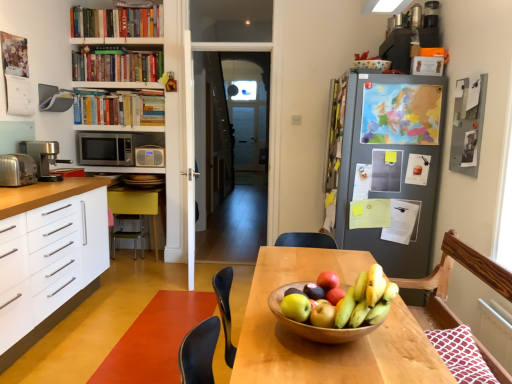
Question: Is hardcover books at upper left, positioned as the second book in top-to-bottom order, with green matte apple at center, placed as the 3th apple when sorted from back to front?

Choices:
 (A) no
 (B) yes

Answer: (A)

Question: From a real-world perspective, is hardcover books at upper left, positioned as the second book in top-to-bottom order, located beneath green matte apple at center, placed as the 3th apple when sorted from back to front?

Choices:
 (A) no
 (B) yes

Answer: (A)

Question: Is the depth of hardcover books at upper left, which is the 2th book in bottom-to-top order, greater than that of green matte apple at center, which is the 2th apple in front-to-back order?

Choices:
 (A) no
 (B) yes

Answer: (B)

Question: Is hardcover books at upper left, positioned as the second book in top-to-bottom order, thinner than green matte apple at center, placed as the 3th apple when sorted from back to front?

Choices:
 (A) yes
 (B) no

Answer: (B)

Question: Does hardcover books at upper left, which is the 2th book in bottom-to-top order, have a smaller size compared to green matte apple at center, which is the 2th apple in front-to-back order?

Choices:
 (A) no
 (B) yes

Answer: (A)

Question: Visually, is wooden table at center positioned to the left or to the right of green matte apple at center, the 4th apple in the back-to-front sequence?

Choices:
 (A) left
 (B) right

Answer: (B)

Question: Is wooden table at center spatially inside green matte apple at center, the 4th apple in the back-to-front sequence, or outside of it?

Choices:
 (A) inside
 (B) outside

Answer: (B)

Question: Is point (289, 365) closer or farther from the camera than point (321, 314)?

Choices:
 (A) farther
 (B) closer

Answer: (B)

Question: In terms of width, does wooden table at center look wider or thinner when compared to green matte apple at center, positioned as the first apple in front-to-back order?

Choices:
 (A) wide
 (B) thin

Answer: (A)

Question: From a real-world perspective, is hardcover book at upper left, the third book viewed from the top, physically located above or below rubberized vinyl floor at lower center?

Choices:
 (A) above
 (B) below

Answer: (A)

Question: Is hardcover book at upper left, the third book viewed from the top, to the left or to the right of rubberized vinyl floor at lower center in the image?

Choices:
 (A) left
 (B) right

Answer: (A)

Question: Considering the positions of point (144, 94) and point (210, 296), is point (144, 94) closer or farther from the camera than point (210, 296)?

Choices:
 (A) farther
 (B) closer

Answer: (A)

Question: Looking at their shapes, would you say hardcover book at upper left, which ranks as the 1th book in bottom-to-top order, is wider or thinner than rubberized vinyl floor at lower center?

Choices:
 (A) thin
 (B) wide

Answer: (A)

Question: From the image's perspective, relative to hardcover books at upper left, which is the 2th book in bottom-to-top order, is hardcover books at upper center, arranged as the third book when ordered from the bottom, above or below?

Choices:
 (A) below
 (B) above

Answer: (B)

Question: From their relative heights in the image, would you say hardcover books at upper center, placed as the first book when sorted from top to bottom, is taller or shorter than hardcover books at upper left, positioned as the second book in top-to-bottom order?

Choices:
 (A) short
 (B) tall

Answer: (A)